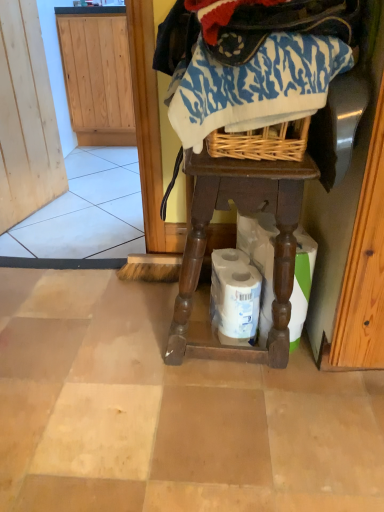
Question: Should I look upward or downward to see white matte toilet paper at lower center, which ranks as the 1th toilet paper in right-to-left order?

Choices:
 (A) down
 (B) up

Answer: (A)

Question: Is blue printed fabric at center not close to white matte toilet paper at lower center, placed as the second toilet paper when sorted from right to left?

Choices:
 (A) no
 (B) yes

Answer: (A)

Question: From a real-world perspective, is blue printed fabric at center positioned over white matte toilet paper at lower center, placed as the second toilet paper when sorted from right to left, based on gravity?

Choices:
 (A) yes
 (B) no

Answer: (A)

Question: From a real-world perspective, does blue printed fabric at center sit lower than white matte toilet paper at lower center, which is the 1th toilet paper in left-to-right order?

Choices:
 (A) yes
 (B) no

Answer: (B)

Question: Considering the relative sizes of blue printed fabric at center and white matte toilet paper at lower center, placed as the second toilet paper when sorted from right to left, in the image provided, is blue printed fabric at center thinner than white matte toilet paper at lower center, placed as the second toilet paper when sorted from right to left,?

Choices:
 (A) no
 (B) yes

Answer: (A)

Question: Is blue printed fabric at center looking in the opposite direction of white matte toilet paper at lower center, which is the 1th toilet paper in left-to-right order?

Choices:
 (A) yes
 (B) no

Answer: (B)

Question: Is blue printed fabric at center facing towards white matte toilet paper at lower center, placed as the second toilet paper when sorted from right to left?

Choices:
 (A) yes
 (B) no

Answer: (B)

Question: Does blue printed fabric at center have a greater height compared to white matte toilet paper at lower center, which ranks as the 1th toilet paper in right-to-left order?

Choices:
 (A) yes
 (B) no

Answer: (B)

Question: Does blue printed fabric at center have a larger size compared to white matte toilet paper at lower center, which ranks as the 2th toilet paper in left-to-right order?

Choices:
 (A) no
 (B) yes

Answer: (B)

Question: Is white matte toilet paper at lower center, which ranks as the 2th toilet paper in left-to-right order, a part of blue printed fabric at center?

Choices:
 (A) yes
 (B) no

Answer: (B)

Question: From the image's perspective, is blue printed fabric at center above white matte toilet paper at lower center, which ranks as the 1th toilet paper in right-to-left order?

Choices:
 (A) yes
 (B) no

Answer: (A)

Question: Would you consider blue printed fabric at center to be distant from white matte toilet paper at lower center, which ranks as the 2th toilet paper in left-to-right order?

Choices:
 (A) yes
 (B) no

Answer: (B)

Question: Is blue printed fabric at center placed right next to white matte toilet paper at lower center, which ranks as the 1th toilet paper in right-to-left order?

Choices:
 (A) yes
 (B) no

Answer: (B)

Question: Does white matte toilet paper at lower center, which ranks as the 1th toilet paper in right-to-left order, have a smaller size compared to blue printed fabric at center?

Choices:
 (A) yes
 (B) no

Answer: (A)